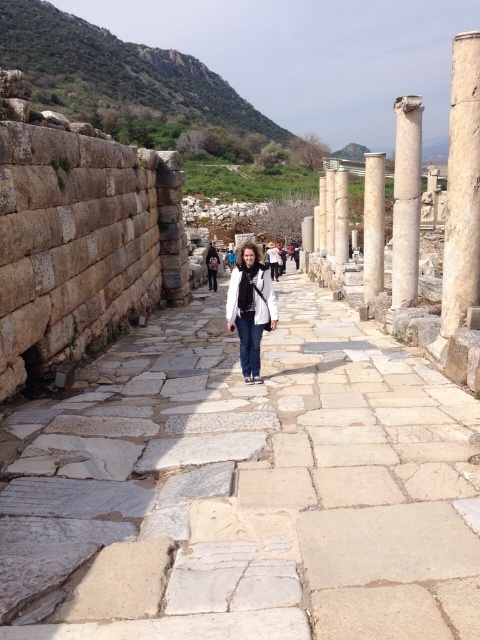
Question: Estimate the real-world distances between objects in this image. Which object is closer to the stone paved pathway at center?

Choices:
 (A) white marble column at center-right
 (B) white marble column at right
 (C) white marble column at center
 (D) white matte jacket at center

Answer: (D)

Question: Observing the image, what is the correct spatial positioning of white marble column at right in reference to white marble column at center?

Choices:
 (A) above
 (B) below

Answer: (B)

Question: Is the position of white marble column at center-right less distant than that of white matte jacket at center?

Choices:
 (A) yes
 (B) no

Answer: (B)

Question: Which object appears closest to the camera in this image?

Choices:
 (A) white matte jacket at center
 (B) white marble column at center-right

Answer: (A)

Question: Considering the relative positions of white marble column at center-right and white matte jacket at center in the image provided, where is white marble column at center-right located with respect to white matte jacket at center?

Choices:
 (A) above
 (B) below

Answer: (A)

Question: Which point is closer to the camera?

Choices:
 (A) white marble column at center
 (B) white marble column at right

Answer: (B)